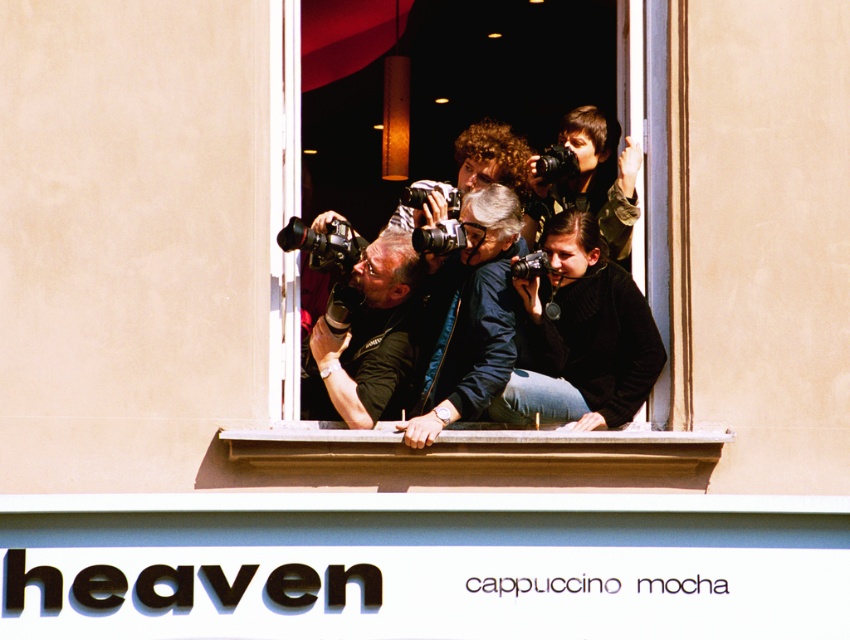
You are standing in front of the window and want to reach both the point at coordinates [556,204] and the point at [581,460]. Which point will you reach first?

The point at coordinates [556,204] will be reached first because it is closer to the viewer compared to the point at [581,460].

You are standing in front of the window where the photographers are leaning out. There are two points marked on the window sill. One is at coordinates point (x=400, y=467) and the other at point (x=486, y=308). Which point is closer to you?

Point (x=400, y=467) is closer to the camera than point (x=486, y=308), so the point at (x=400, y=467) is closer to you.